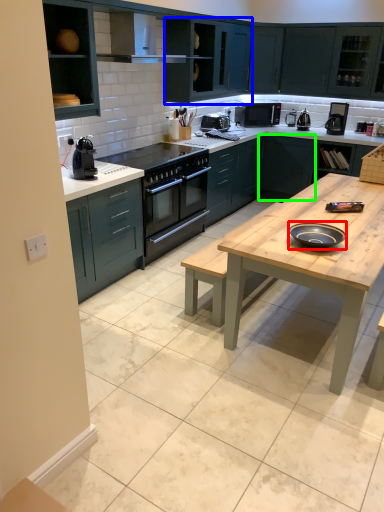
Question: Based on their relative distances, which object is nearer to pizza pan (highlighted by a red box)? Choose from cabinetry (highlighted by a blue box) and cabinetry (highlighted by a green box).

Choices:
 (A) cabinetry
 (B) cabinetry

Answer: (B)